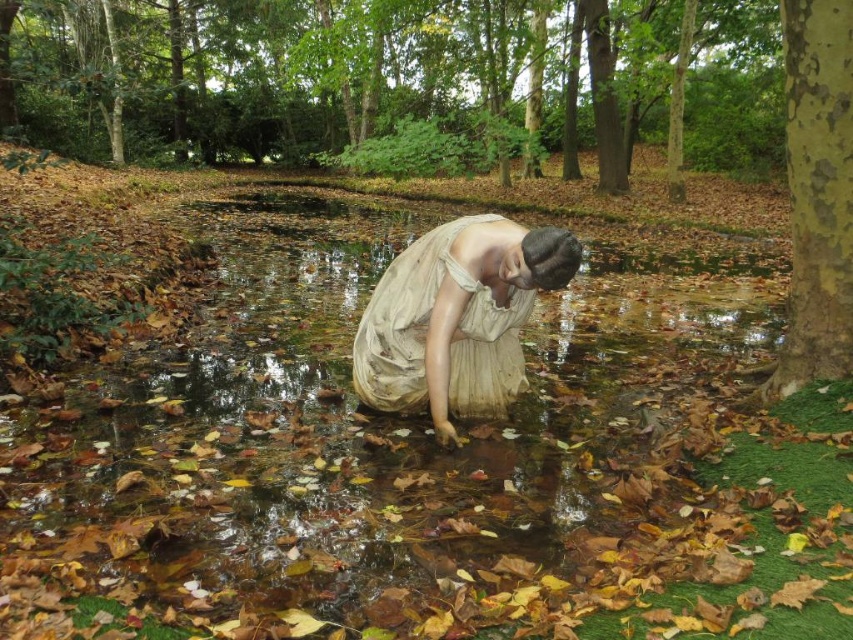
Which is behind, point (456, 368) or point (804, 282)?

Positioned behind is point (456, 368).

Does matte white dress at center appear on the right side of smooth bark tree trunk at right?

No, matte white dress at center is not to the right of smooth bark tree trunk at right.

Which is behind, point (492, 403) or point (799, 228)?

The point (492, 403) is behind.

Find the location of `matte white dress at center`. matte white dress at center is located at coordinates (457, 317).

Which is below, clear water at center or matte white dress at center?

matte white dress at center

Can you confirm if clear water at center is wider than matte white dress at center?

Correct, the width of clear water at center exceeds that of matte white dress at center.

The height and width of the screenshot is (640, 853). I want to click on clear water at center, so click(372, 444).

Does point (198, 566) lie in front of point (786, 328)?

Yes, it is in front of point (786, 328).

Does clear water at center come in front of smooth bark tree trunk at right?

Yes, it is in front of smooth bark tree trunk at right.

Is point (450, 586) farther from viewer compared to point (810, 36)?

No, it is in front of (810, 36).

Locate an element on the screen. clear water at center is located at coordinates (372, 444).